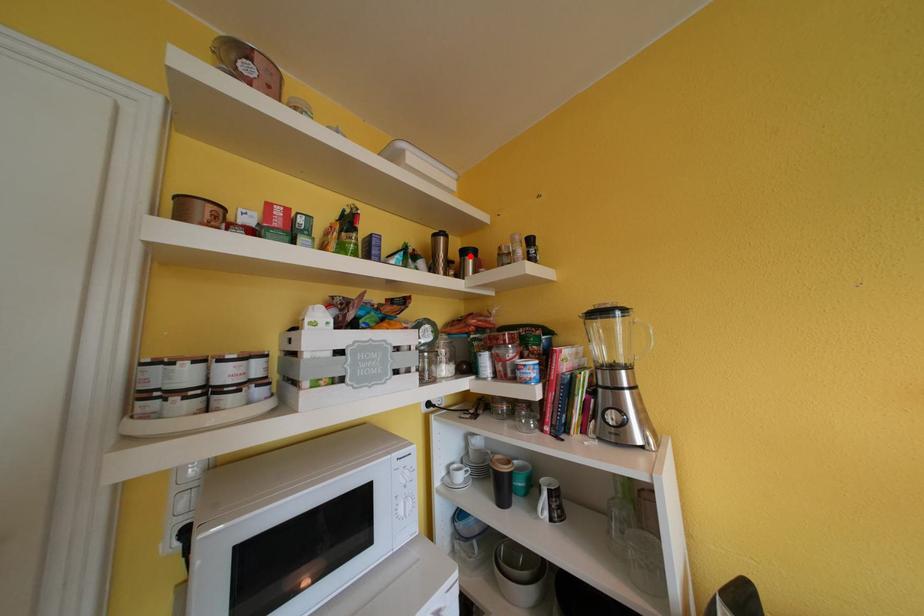
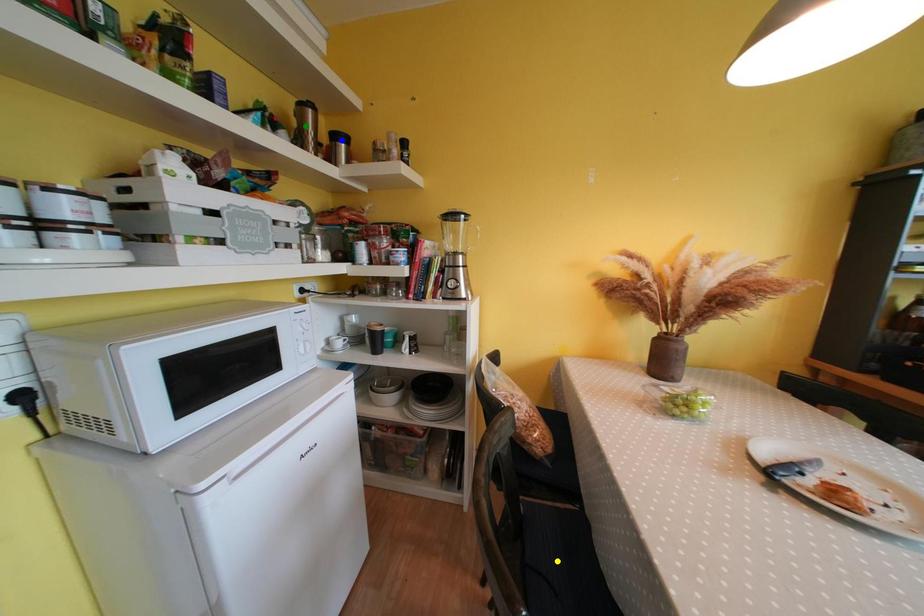
Question: I am providing you with two images of the same scene from different viewpoints. A red point is marked on the first image. You are given multiple points on the second image. Which point in image 2 represents the same 3d spot as the red point in image 1?

Choices:
 (A) green point
 (B) blue point
 (C) yellow point

Answer: (B)